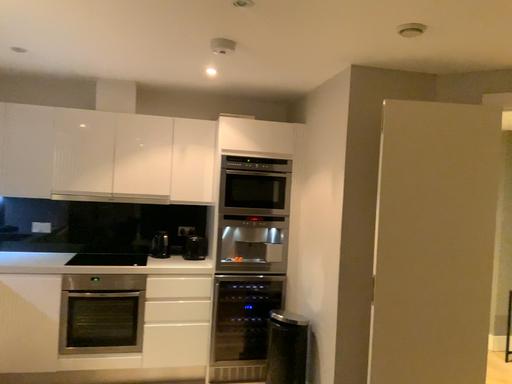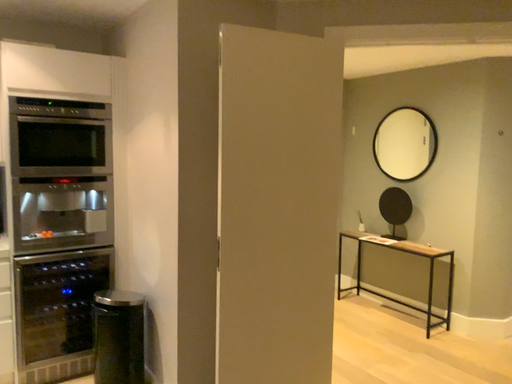
Question: How did the camera likely rotate when shooting the video?

Choices:
 (A) rotated right
 (B) rotated left

Answer: (A)